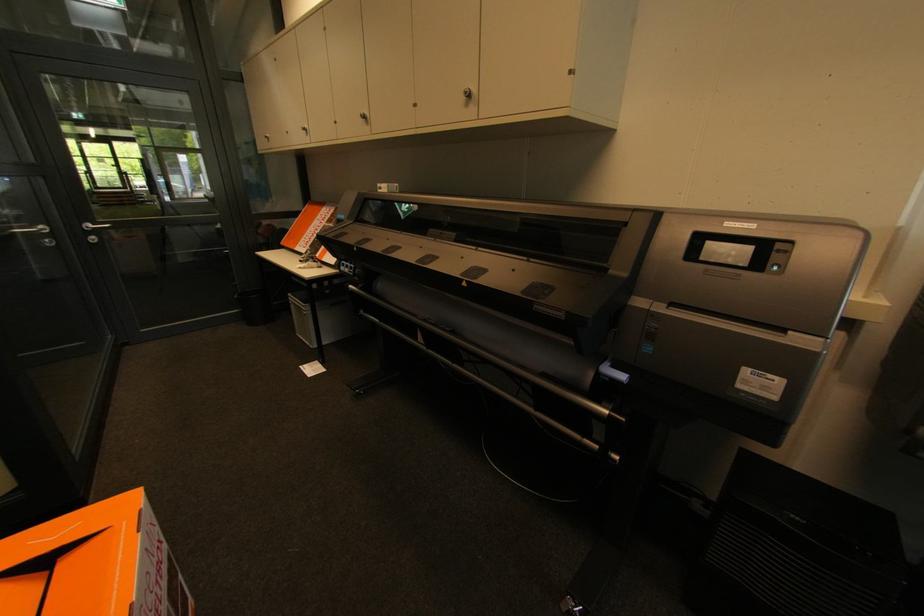
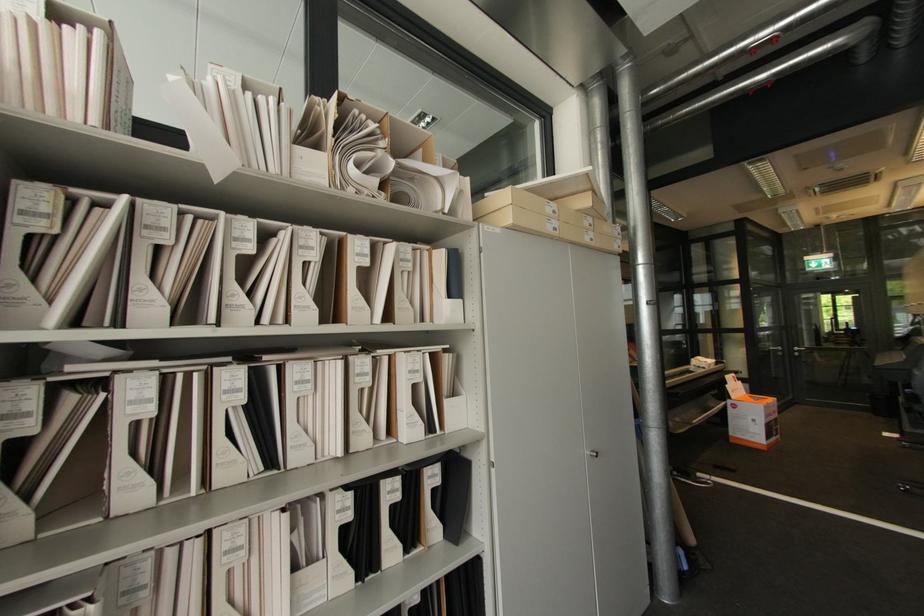
The point at (96, 238) is marked in the first image. Where is the corresponding point in the second image?

(800, 354)